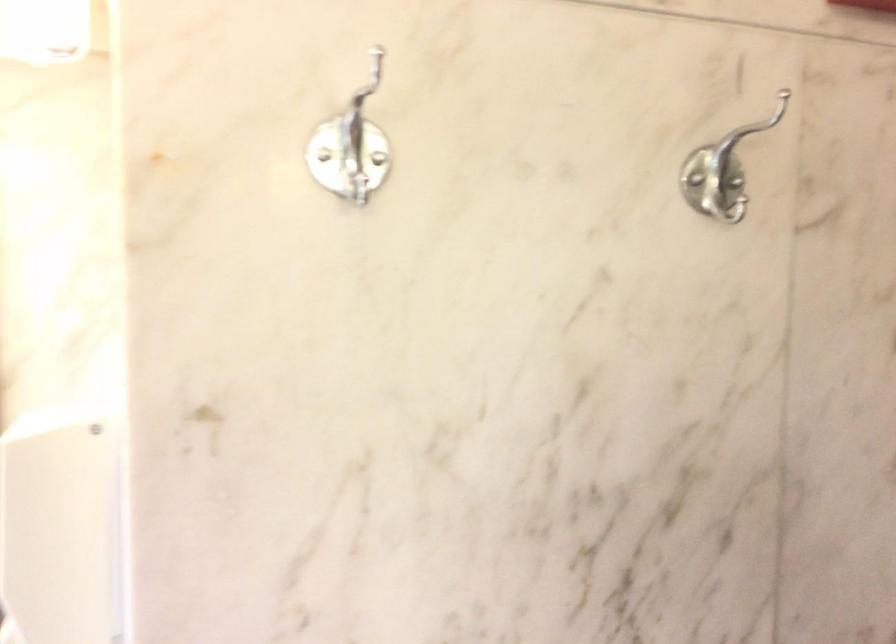
The images are taken continuously from a first-person perspective. In which direction is your viewpoint rotating?

The camera rotated toward left-down.